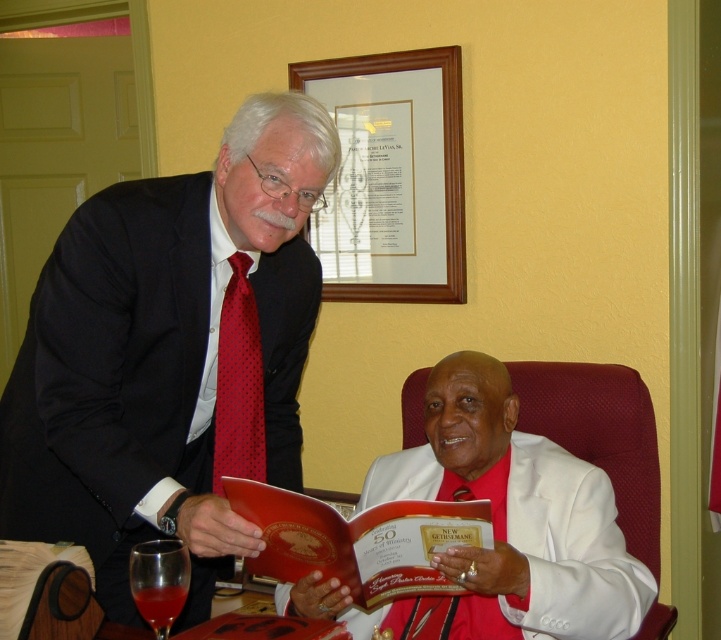
Consider the image. What is the spatial relationship between the wooden picture frame at upper center and the matte red book at center?

The wooden picture frame at upper center is positioned on the right side of the matte red book at center.

From the picture: You are organizing a charity event and need to ensure that all attire fits properly. Given the white satin suit at center and the red dotted tie at left, which item requires a larger size to accommodate its dimensions?

The white satin suit at center requires a larger size because it has a larger size compared to the red dotted tie at left.